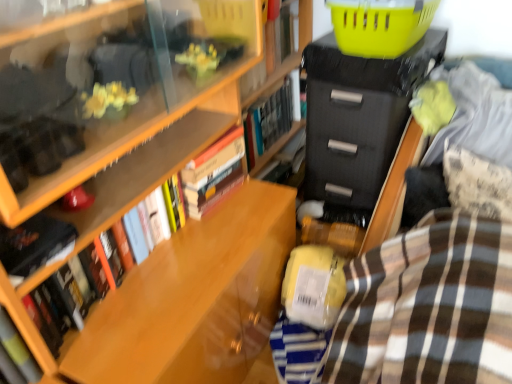
Question: Do you think yellow plastic basket at upper right is within hardcover book at center, the fifth book in the front-to-back sequence, or outside of it?

Choices:
 (A) outside
 (B) inside

Answer: (A)

Question: In terms of height, does yellow plastic basket at upper right look taller or shorter compared to hardcover book at center, the fifth book in the front-to-back sequence?

Choices:
 (A) short
 (B) tall

Answer: (A)

Question: Which is nearer to the hardcover book at lower left, the fifth book from the back?

Choices:
 (A) hardcover book at upper center, acting as the 4th book starting from the front
 (B) brown striped blanket at lower right
 (C) hardcover book at center, the fifth book in the front-to-back sequence
 (D) black matte/file cabinet at upper right
 (E) hardcover book at left, the 4th book from the back

Answer: (E)

Question: Estimate the real-world distances between objects in this image. Which object is farther from the hardcover book at lower left, the 1th book in the front-to-back sequence?

Choices:
 (A) black matte/file cabinet at upper right
 (B) hardcover book at upper center, the second book in the back-to-front sequence
 (C) brown striped blanket at lower right
 (D) hardcover book at left, the 4th book from the back
 (E) yellow plastic basket at upper right

Answer: (B)